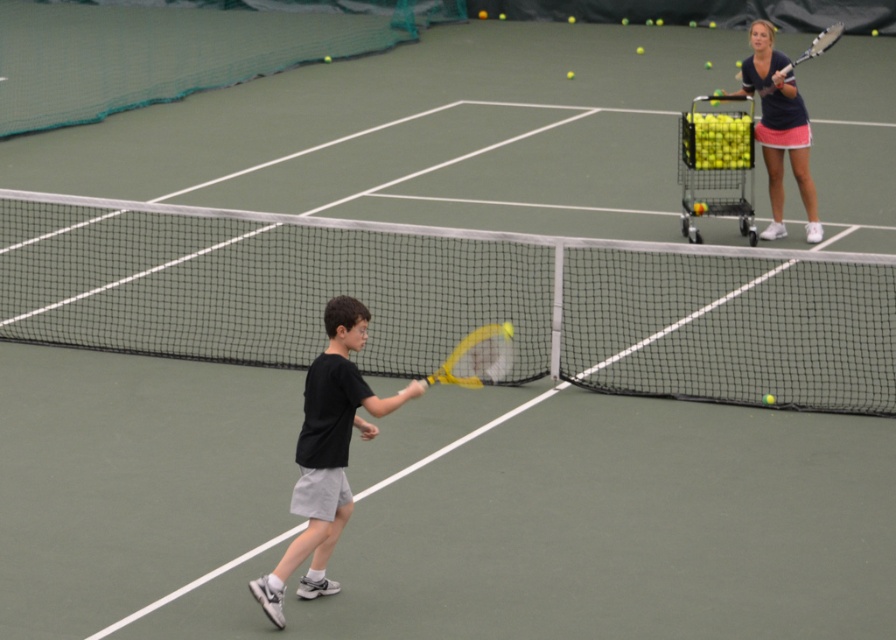
Question: Which object is the closest to the matte blue tennis racket at upper right?

Choices:
 (A) black mesh tennis net at center
 (B) yellow matte tennis racket at upper right
 (C) yellow matte tennis racket at center

Answer: (B)

Question: Which object is farther from the camera taking this photo?

Choices:
 (A) yellow matte tennis racket at upper right
 (B) matte blue tennis racket at upper right
 (C) metallic yellow shopping cart at upper right

Answer: (C)

Question: Can you confirm if black mesh tennis net at center is positioned below yellow matte tennis racket at center?

Choices:
 (A) yes
 (B) no

Answer: (B)

Question: Estimate the real-world distances between objects in this image. Which object is closer to the black matte tennis racket at center?

Choices:
 (A) black mesh tennis net at center
 (B) yellow matte tennis racket at upper right

Answer: (A)

Question: In this image, where is metallic yellow shopping cart at upper right located relative to yellow matte tennis racket at upper right?

Choices:
 (A) below
 (B) above

Answer: (A)

Question: Does black mesh tennis net at center appear over matte blue tennis racket at upper right?

Choices:
 (A) yes
 (B) no

Answer: (B)